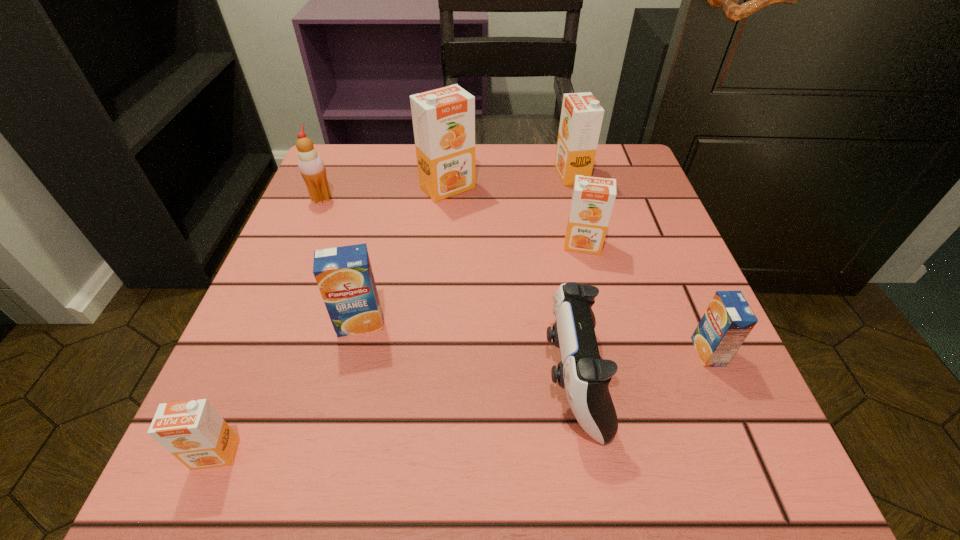
This screenshot has height=540, width=960. I want to click on the leftmost orange orange juice, so click(x=193, y=431).

The image size is (960, 540). Find the location of `the rightmost object`. the rightmost object is located at coordinates (728, 320).

The image size is (960, 540). I want to click on the right blue orange_juice, so click(x=728, y=320).

At what (x,y) coordinates should I click in order to perform the action: click on free space located 0.180m on the right of the third orange_juice from left to right. Please return your answer as a coordinate pair (x, y). The height and width of the screenshot is (540, 960). Looking at the image, I should click on (558, 187).

Locate an element on the screen. blank space located on the front of the second biggest orange orange juice is located at coordinates (598, 278).

This screenshot has height=540, width=960. Find the location of `vacant space situated 0.340m at the front with a straw on the icecream`. vacant space situated 0.340m at the front with a straw on the icecream is located at coordinates (493, 199).

This screenshot has width=960, height=540. What are the coordinates of `vacant space located on the front of the second nearest orange orange juice` in the screenshot? It's located at (608, 350).

Find the location of a particular element. blank space located 0.080m on the left of the fifth orange_juice from right to left is located at coordinates (285, 323).

This screenshot has height=540, width=960. I want to click on vacant area situated on the front-facing side of the control, so click(490, 380).

You are a GUI agent. You are given a task and a screenshot of the screen. Output one action in this format:
    pyautogui.click(x=<x>, y=<y>)
    Task: Click on the vacant region located 0.390m on the front-facing side of the control
    
    Given the screenshot: What is the action you would take?
    pyautogui.click(x=274, y=380)